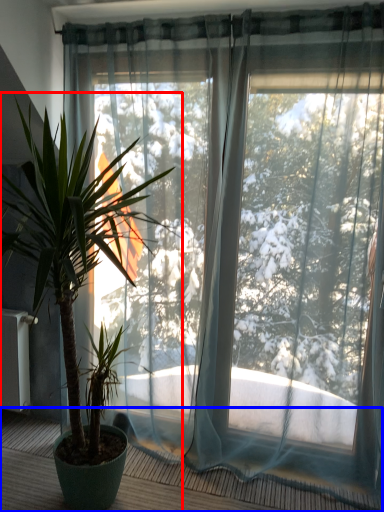
Question: Which object appears farthest to the camera in this image, houseplant (highlighted by a red box) or balcony (highlighted by a blue box)?

Choices:
 (A) houseplant
 (B) balcony

Answer: (B)